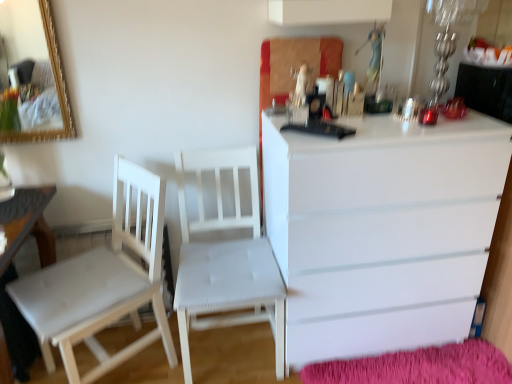
What is the approximate height of white glossy chest of drawers at right?

→ white glossy chest of drawers at right is 38.53 inches in height.

Describe the element at coordinates (382, 230) in the screenshot. The height and width of the screenshot is (384, 512). I see `white glossy chest of drawers at right` at that location.

Image resolution: width=512 pixels, height=384 pixels. Describe the element at coordinates (226, 259) in the screenshot. I see `white fabric chair at center, acting as the 2th chair starting from the left` at that location.

Where is `white glossy chest of drawers at right`? The width and height of the screenshot is (512, 384). white glossy chest of drawers at right is located at coordinates (382, 230).

From a real-world perspective, which object rests below the other?

In real-world perspective, fuzzy pink mat at lower right is lower.

Measure the distance between fuzzy pink mat at lower right and white wood chair at center, which is the 2th chair in right-to-left order.

They are 37.18 inches apart.

Would you say fuzzy pink mat at lower right is outside white wood chair at center, which is the 2th chair in right-to-left order?

fuzzy pink mat at lower right is positioned outside white wood chair at center, which is the 2th chair in right-to-left order.

Are fuzzy pink mat at lower right and white wood chair at center, arranged as the first chair when viewed from the left, beside each other?

No, fuzzy pink mat at lower right is not next to white wood chair at center, arranged as the first chair when viewed from the left.

From the picture: In the image, is white wood chair at center, arranged as the first chair when viewed from the left, on the left side or the right side of white fabric chair at center, acting as the 2th chair starting from the left?

white wood chair at center, arranged as the first chair when viewed from the left, is to the left of white fabric chair at center, acting as the 2th chair starting from the left.

Can we say white wood chair at center, which is the 2th chair in right-to-left order, lies outside white fabric chair at center, acting as the 2th chair starting from the left?

Yes, white wood chair at center, which is the 2th chair in right-to-left order, is outside of white fabric chair at center, acting as the 2th chair starting from the left.

In terms of width, does white wood chair at center, which is the 2th chair in right-to-left order, look wider or thinner when compared to white fabric chair at center, the 1th chair from the right?

white wood chair at center, which is the 2th chair in right-to-left order, is wider than white fabric chair at center, the 1th chair from the right.

Considering the sizes of white fabric chair at center, acting as the 2th chair starting from the left, and white wood chair at center, arranged as the first chair when viewed from the left, in the image, is white fabric chair at center, acting as the 2th chair starting from the left, wider or thinner than white wood chair at center, arranged as the first chair when viewed from the left,?

In the image, white fabric chair at center, acting as the 2th chair starting from the left, appears to be more narrow than white wood chair at center, arranged as the first chair when viewed from the left.

Looking at this image, from the image's perspective, is white fabric chair at center, acting as the 2th chair starting from the left, beneath white wood chair at center, arranged as the first chair when viewed from the left?

Incorrect, from the image's perspective, white fabric chair at center, acting as the 2th chair starting from the left, is higher than white wood chair at center, arranged as the first chair when viewed from the left.

Based on the photo, based on their positions, is white fabric chair at center, acting as the 2th chair starting from the left, located to the left or right of white wood chair at center, which is the 2th chair in right-to-left order?

Clearly, white fabric chair at center, acting as the 2th chair starting from the left, is on the right of white wood chair at center, which is the 2th chair in right-to-left order, in the image.

Would you consider white fabric chair at center, acting as the 2th chair starting from the left, to be distant from white wood chair at center, which is the 2th chair in right-to-left order?

No, white fabric chair at center, acting as the 2th chair starting from the left, is in close proximity to white wood chair at center, which is the 2th chair in right-to-left order.

Can you confirm if white glossy chest of drawers at right is shorter than white wood table at lower left?

No.

Is white glossy chest of drawers at right positioned with its back to white wood table at lower left?

No.

There is a white wood table at lower left. Identify the location of the chest of drawers above it (from a real-world perspective). (382, 230).

Which of these two, white glossy chest of drawers at right or white wood table at lower left, is bigger?

white glossy chest of drawers at right is bigger.

Is white fabric chair at center, the 1th chair from the right, bigger or smaller than fuzzy pink mat at lower right?

Clearly, white fabric chair at center, the 1th chair from the right, is larger in size than fuzzy pink mat at lower right.

Locate an element on the screen. This screenshot has height=384, width=512. chair that is the 2nd object above the fuzzy pink mat at lower right (from a real-world perspective) is located at coordinates (226, 259).

From the image's perspective, does white fabric chair at center, the 1th chair from the right, appear higher than fuzzy pink mat at lower right?

Yes, from the image's perspective, white fabric chair at center, the 1th chair from the right, is above fuzzy pink mat at lower right.

Which of these two, white fabric chair at center, acting as the 2th chair starting from the left, or fuzzy pink mat at lower right, stands shorter?

fuzzy pink mat at lower right is shorter.

From a real-world perspective, which is physically above, white wood table at lower left or white fabric chair at center, acting as the 2th chair starting from the left?

white fabric chair at center, acting as the 2th chair starting from the left, from a real-world perspective.

Considering the sizes of objects white wood table at lower left and white fabric chair at center, acting as the 2th chair starting from the left, in the image provided, who is wider, white wood table at lower left or white fabric chair at center, acting as the 2th chair starting from the left,?

With larger width is white wood table at lower left.

From the image's perspective, is white wood table at lower left positioned above or below white fabric chair at center, acting as the 2th chair starting from the left?

Clearly, from the image's perspective, white wood table at lower left is below white fabric chair at center, acting as the 2th chair starting from the left.

Between white wood chair at center, which is the 2th chair in right-to-left order, and white wood table at lower left, which one has larger width?

With larger width is white wood table at lower left.

Based on the photo, are white wood chair at center, arranged as the first chair when viewed from the left, and white wood table at lower left located far from each other?

white wood chair at center, arranged as the first chair when viewed from the left, is near white wood table at lower left, not far away.

Is the position of white wood chair at center, arranged as the first chair when viewed from the left, less distant than that of white wood table at lower left?

That is False.

From a real-world perspective, is white wood chair at center, which is the 2th chair in right-to-left order, physically below white wood table at lower left?

Incorrect, from a real-world perspective, white wood chair at center, which is the 2th chair in right-to-left order, is higher than white wood table at lower left.

Find the location of a particular element. The height and width of the screenshot is (384, 512). mat on the right side of white wood chair at center, arranged as the first chair when viewed from the left is located at coordinates (418, 367).

What are the coordinates of `chair that appears on the left of white fabric chair at center, the 1th chair from the right` in the screenshot? It's located at (103, 283).

Looking at this image, based on their spatial positions, is white glossy chest of drawers at right or white fabric chair at center, the 1th chair from the right, further from white wood table at lower left?

white glossy chest of drawers at right is positioned further to the anchor white wood table at lower left.

Looking at the image, which one is located closer to white fabric chair at center, the 1th chair from the right, white glossy chest of drawers at right or fuzzy pink mat at lower right?

Among the two, white glossy chest of drawers at right is located nearer to white fabric chair at center, the 1th chair from the right.

Looking at the image, which one is located closer to white fabric chair at center, acting as the 2th chair starting from the left, white wood chair at center, arranged as the first chair when viewed from the left, or white wood table at lower left?

white wood chair at center, arranged as the first chair when viewed from the left, lies closer to white fabric chair at center, acting as the 2th chair starting from the left, than the other object.

Based on their spatial positions, is fuzzy pink mat at lower right or white wood table at lower left further from white glossy chest of drawers at right?

white wood table at lower left is further to white glossy chest of drawers at right.

Consider the image. Considering their positions, is fuzzy pink mat at lower right positioned further to white fabric chair at center, acting as the 2th chair starting from the left, than white wood table at lower left?

white wood table at lower left.

Which object lies further to the anchor point white wood chair at center, arranged as the first chair when viewed from the left, white fabric chair at center, acting as the 2th chair starting from the left, or white glossy chest of drawers at right?

white glossy chest of drawers at right is positioned further to the anchor white wood chair at center, arranged as the first chair when viewed from the left.

Which object lies nearer to the anchor point white wood table at lower left, white fabric chair at center, acting as the 2th chair starting from the left, or white glossy chest of drawers at right?

white fabric chair at center, acting as the 2th chair starting from the left, lies closer to white wood table at lower left than the other object.

Based on their spatial positions, is white wood chair at center, arranged as the first chair when viewed from the left, or white wood table at lower left further from white glossy chest of drawers at right?

The object further to white glossy chest of drawers at right is white wood table at lower left.

In order to click on the chest of drawers situated between white fabric chair at center, acting as the 2th chair starting from the left, and fuzzy pink mat at lower right from left to right in this screenshot , I will do `click(382, 230)`.

Locate an element on the screen. This screenshot has height=384, width=512. chair situated between white wood chair at center, arranged as the first chair when viewed from the left, and fuzzy pink mat at lower right from left to right is located at coordinates (226, 259).

The height and width of the screenshot is (384, 512). I want to click on chair located between white wood chair at center, arranged as the first chair when viewed from the left, and white glossy chest of drawers at right in the left-right direction, so click(x=226, y=259).

Find the location of a particular element. the chest of drawers located between white wood chair at center, which is the 2th chair in right-to-left order, and fuzzy pink mat at lower right in the left-right direction is located at coordinates (382, 230).